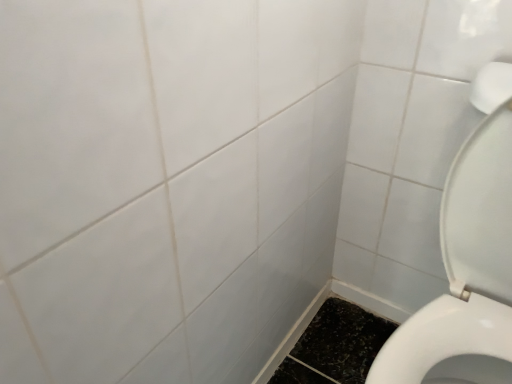
This screenshot has height=384, width=512. What do you see at coordinates (466, 274) in the screenshot?
I see `white glossy toilet at right` at bounding box center [466, 274].

Where is `white glossy toilet at right`? white glossy toilet at right is located at coordinates (466, 274).

The width and height of the screenshot is (512, 384). In order to click on white glossy toilet at right in this screenshot , I will do `click(466, 274)`.